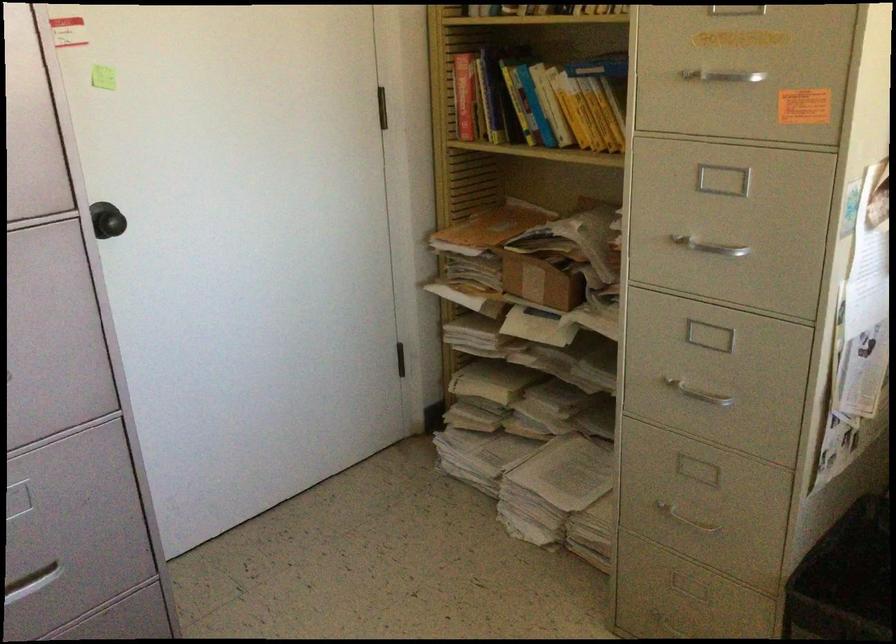
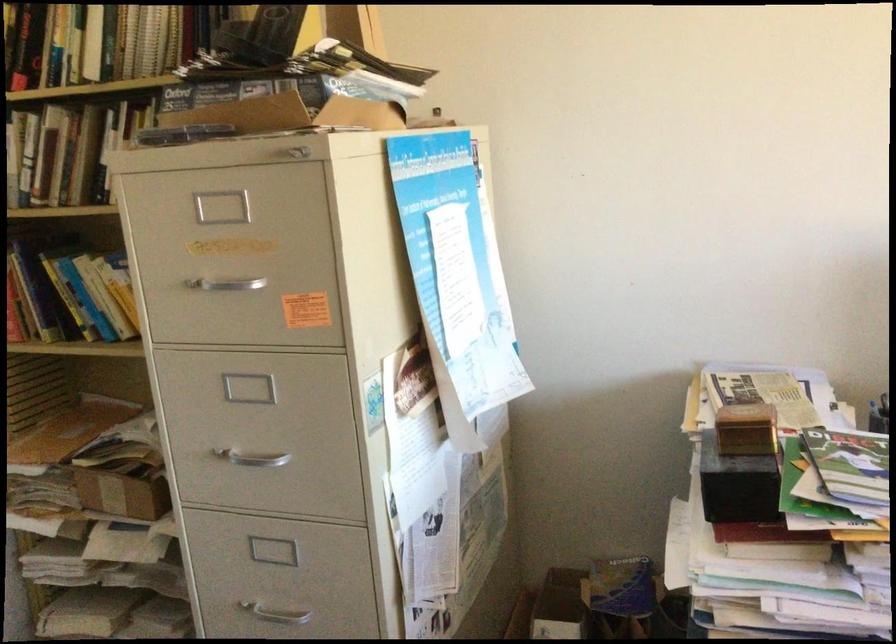
In the second image, find the point that corresponds to pixel 702 247 in the first image.

(251, 458)